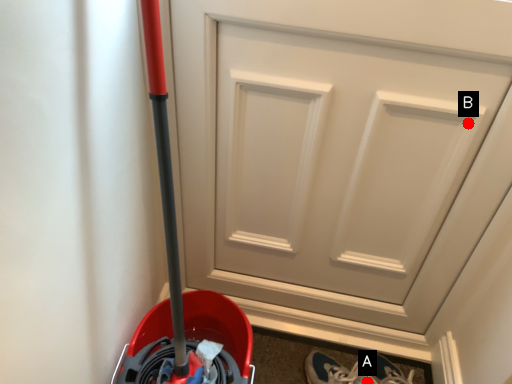
Question: Two points are circled on the image, labeled by A and B beside each circle. Which point is further to the camera?

Choices:
 (A) A is further
 (B) B is further

Answer: (A)